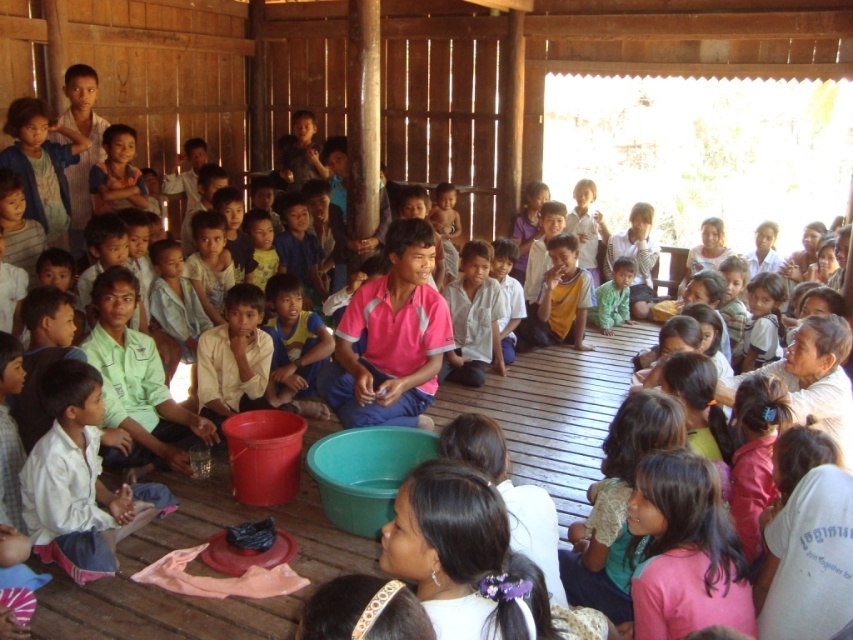
You are a photographer standing at the back of the room. You want to take a photo that includes both the pink fabric shirt at center and the green matte shirt at center. Given that your camera has a maximum focus range of 8 feet, will you be able to capture both subjects clearly in the same frame?

The distance between the pink fabric shirt at center and the green matte shirt at center is 9.67 feet, which exceeds the camera maximum focus range of 8 feet. Therefore, you will not be able to capture both subjects clearly in the same frame.